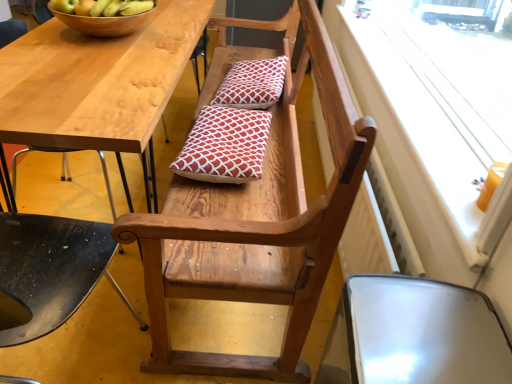
Question: Considering the relative positions of green matte apple at upper left, positioned as the second apple in left-to-right order, and wooden chair at center, the 2th chair positioned from the right, in the image provided, is green matte apple at upper left, positioned as the second apple in left-to-right order, to the left of wooden chair at center, the 2th chair positioned from the right, from the viewer's perspective?

Choices:
 (A) yes
 (B) no

Answer: (A)

Question: Is green matte apple at upper left, positioned as the second apple in left-to-right order, not close to wooden chair at center, which is counted as the second chair, starting from the left?

Choices:
 (A) no
 (B) yes

Answer: (A)

Question: Considering the relative sizes of green matte apple at upper left, positioned as the second apple in left-to-right order, and wooden chair at center, the 2th chair positioned from the right, in the image provided, is green matte apple at upper left, positioned as the second apple in left-to-right order, thinner than wooden chair at center, the 2th chair positioned from the right,?

Choices:
 (A) no
 (B) yes

Answer: (B)

Question: From the image's perspective, is green matte apple at upper left, which ranks as the 1th apple in right-to-left order, below wooden chair at center, the 2th chair positioned from the right?

Choices:
 (A) yes
 (B) no

Answer: (B)

Question: Can we say green matte apple at upper left, which ranks as the 1th apple in right-to-left order, lies outside wooden chair at center, the 2th chair positioned from the right?

Choices:
 (A) no
 (B) yes

Answer: (B)

Question: From the image's perspective, relative to red printed cushion at center, which is the first pillow from back to front, is red printed cushion at center, which ranks as the first pillow in bottom-to-top order, above or below?

Choices:
 (A) below
 (B) above

Answer: (A)

Question: Is red printed cushion at center, the first pillow from the front, wider or thinner than red printed cushion at center, which is the first pillow from back to front?

Choices:
 (A) thin
 (B) wide

Answer: (A)

Question: Considering the positions of red printed cushion at center, positioned as the second pillow in top-to-bottom order, and red printed cushion at center, the 1th pillow viewed from the top, in the image, is red printed cushion at center, positioned as the second pillow in top-to-bottom order, taller or shorter than red printed cushion at center, the 1th pillow viewed from the top,?

Choices:
 (A) tall
 (B) short

Answer: (B)

Question: Considering the relative positions of red printed cushion at center, the first pillow from the front, and red printed cushion at center, the 1th pillow viewed from the top, in the image provided, is red printed cushion at center, the first pillow from the front, to the left or to the right of red printed cushion at center, the 1th pillow viewed from the top,?

Choices:
 (A) right
 (B) left

Answer: (B)

Question: Considering the positions of point (96, 238) and point (105, 34), is point (96, 238) closer or farther from the camera than point (105, 34)?

Choices:
 (A) farther
 (B) closer

Answer: (B)

Question: From a real-world perspective, is wooden chair at lower center, the first chair from the left, physically located above or below wooden bowl at upper left?

Choices:
 (A) above
 (B) below

Answer: (B)

Question: Is wooden chair at lower center, the first chair from the left, to the left or to the right of wooden bowl at upper left in the image?

Choices:
 (A) left
 (B) right

Answer: (A)

Question: Is wooden chair at lower center, which appears as the 3th chair when viewed from the right, wider or thinner than wooden bowl at upper left?

Choices:
 (A) thin
 (B) wide

Answer: (B)

Question: From a real-world perspective, is green matte apple at upper left, positioned as the second apple in left-to-right order, positioned above or below red printed cushion at center, which is the first pillow from back to front?

Choices:
 (A) above
 (B) below

Answer: (A)

Question: Is green matte apple at upper left, positioned as the second apple in left-to-right order, inside the boundaries of red printed cushion at center, which is the first pillow from back to front, or outside?

Choices:
 (A) outside
 (B) inside

Answer: (A)